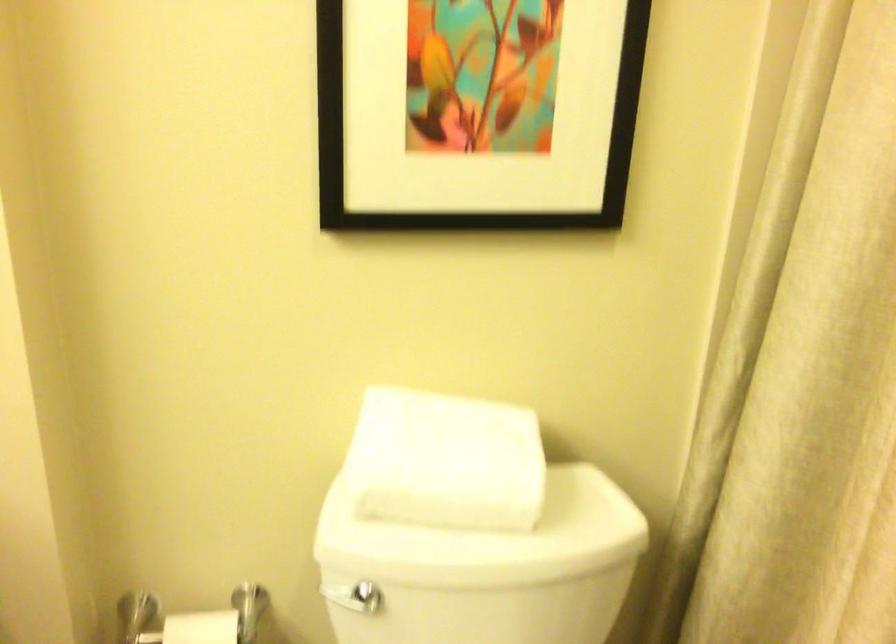
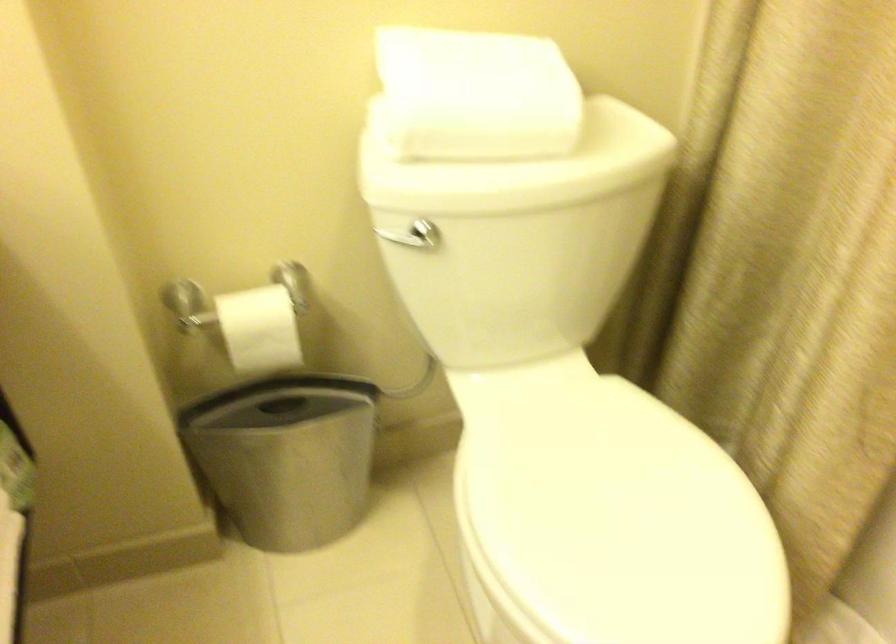
In the second image, find the point that corresponds to (x=437, y=467) in the first image.

(476, 95)